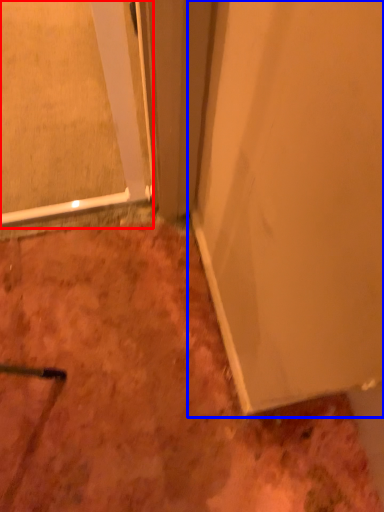
Question: Among these objects, which one is nearest to the camera, glass door (highlighted by a red box) or door (highlighted by a blue box)?

Choices:
 (A) glass door
 (B) door

Answer: (B)